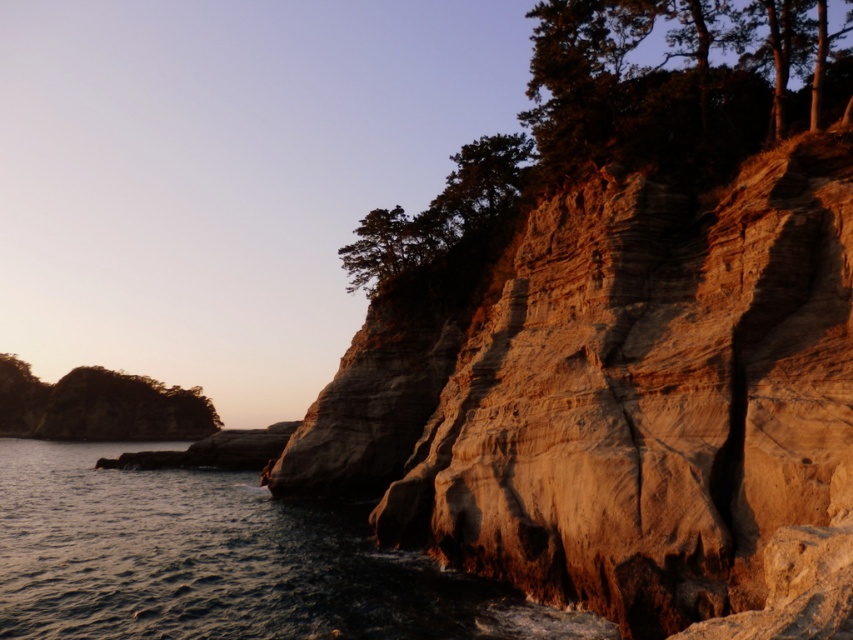
Question: Is rustic stone cliff at right to the left of dark blue water at lower left from the viewer's perspective?

Choices:
 (A) no
 (B) yes

Answer: (A)

Question: Is rustic stone cliff at right thinner than green leafy tree at left?

Choices:
 (A) no
 (B) yes

Answer: (B)

Question: Is dark green textured tree at upper right thinner than green textured tree at upper center?

Choices:
 (A) no
 (B) yes

Answer: (A)

Question: Among these objects, which one is farthest from the camera?

Choices:
 (A) rustic stone cliff at right
 (B) dark blue water at lower left
 (C) green textured tree at upper center
 (D) dark green textured tree at upper right

Answer: (C)

Question: Which is farther from the rustic stone cliff at right?

Choices:
 (A) dark blue water at lower left
 (B) dark green textured tree at upper right
 (C) green leafy tree at left

Answer: (C)

Question: Which point is closer to the camera taking this photo?

Choices:
 (A) (759, 592)
 (B) (316, 609)

Answer: (A)